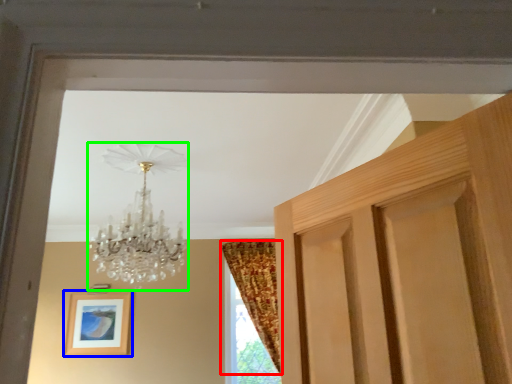
Question: Which object is the closest to the curtain (highlighted by a red box)? Choose among these: picture frame (highlighted by a blue box) or lamp (highlighted by a green box).

Choices:
 (A) picture frame
 (B) lamp

Answer: (A)